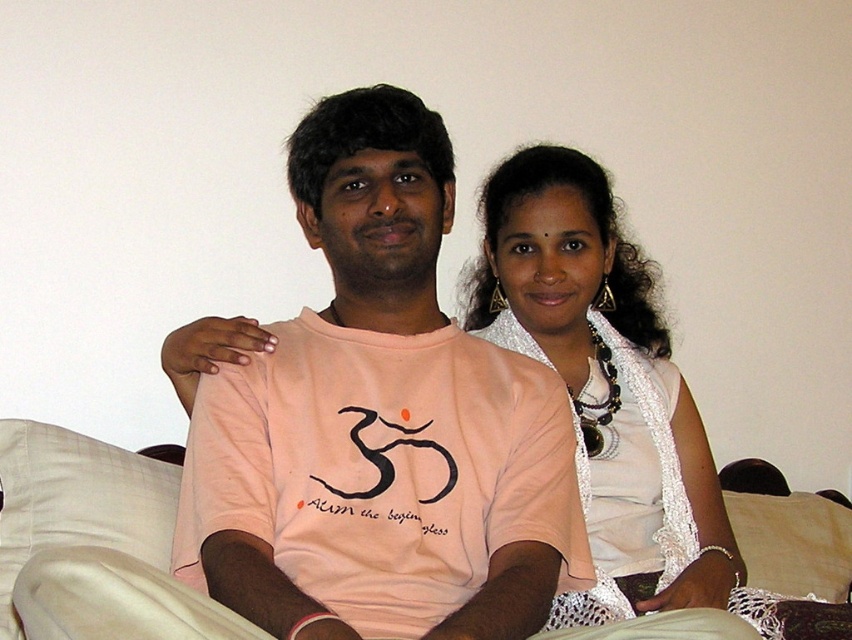
In the scene shown: Which of these two, pink cotton t-shirt at center or white lace scarf at upper right, stands taller?

With more height is white lace scarf at upper right.

Who is positioned more to the right, pink cotton t-shirt at center or white lace scarf at upper right?

white lace scarf at upper right

Who is more forward, [455,580] or [576,456]?

Point [455,580] is in front.

Where is `pink cotton t-shirt at center`? pink cotton t-shirt at center is located at coordinates (380, 422).

Is pink cotton t-shirt at center below beige fabric pillow at lower right?

Incorrect, pink cotton t-shirt at center is not positioned below beige fabric pillow at lower right.

Does pink cotton t-shirt at center have a lesser width compared to beige fabric pillow at lower right?

No.

This screenshot has height=640, width=852. I want to click on pink cotton t-shirt at center, so click(380, 422).

Who is more distant from viewer, (557, 189) or (764, 572)?

Point (764, 572)

Between point (614, 273) and point (738, 524), which one is positioned in front?

Positioned in front is point (614, 273).

Image resolution: width=852 pixels, height=640 pixels. Describe the element at coordinates (603, 385) in the screenshot. I see `white lace scarf at upper right` at that location.

Image resolution: width=852 pixels, height=640 pixels. What are the coordinates of `white lace scarf at upper right` in the screenshot? It's located at pos(603,385).